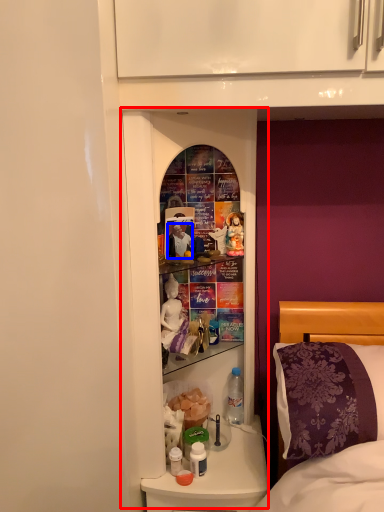
Question: Which of the following is the farthest to the observer, medicine cabinet (highlighted by a red box) or person (highlighted by a blue box)?

Choices:
 (A) medicine cabinet
 (B) person

Answer: (B)